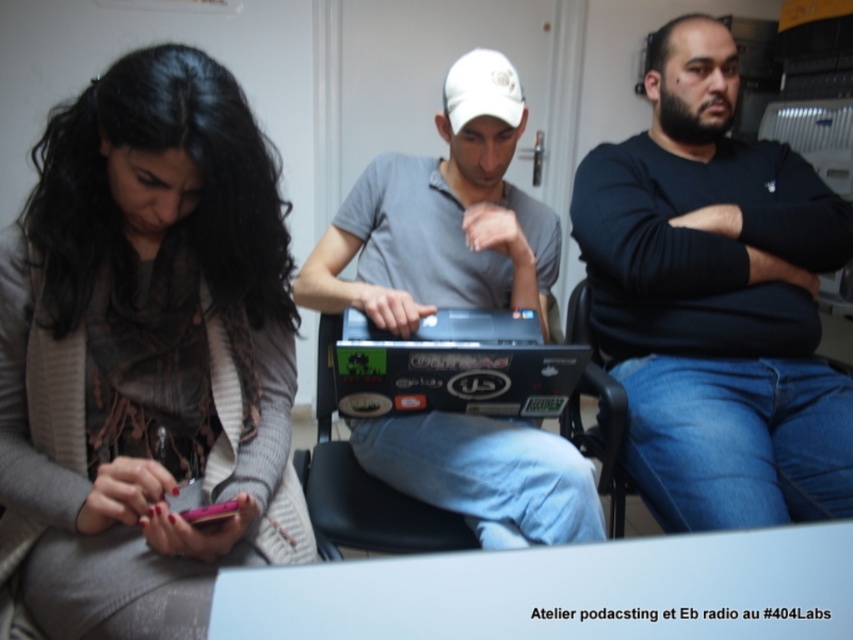
In the scene described, there are three people sitting in a room with a matte pink phone at lower left. Where exactly is the matte pink phone located in terms of coordinates?

The matte pink phone at lower left is located at coordinates point [144,356].